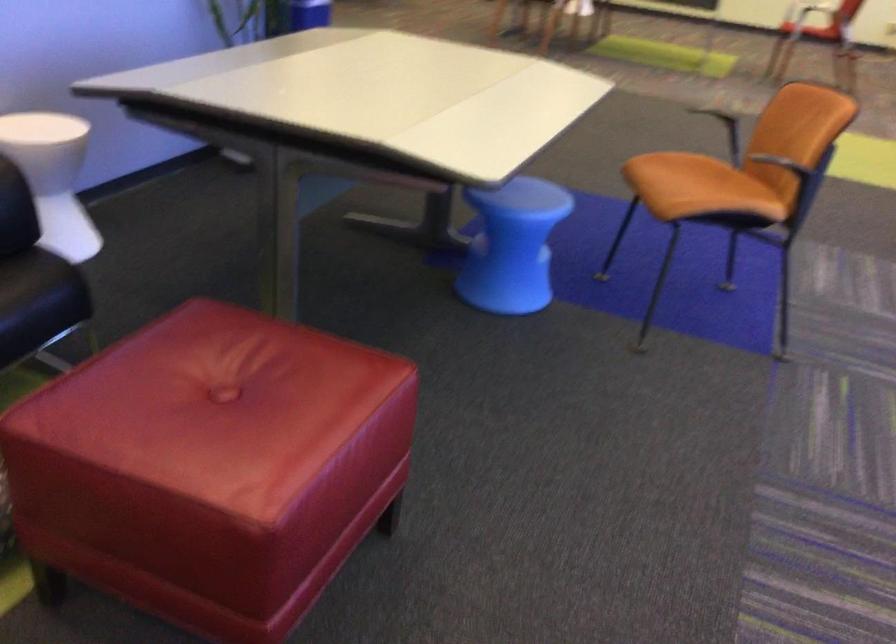
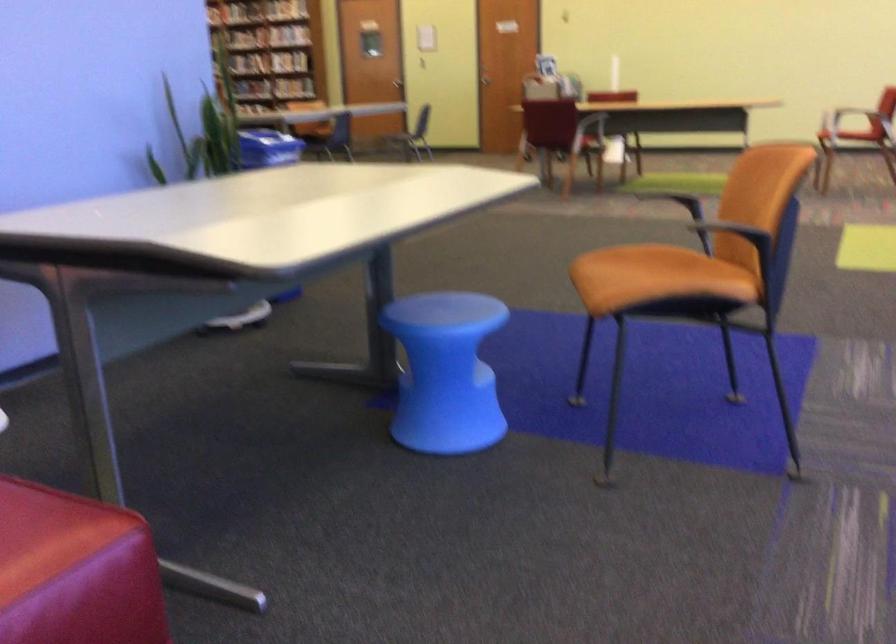
Question: I am providing you with two images of the same scene from different viewpoints. After the viewpoint changes to image2, which objects are now occluded?

Choices:
 (A) red sofa sitting surface
 (B) blue plastic bin
 (C) black chair armrest
 (D) none of these

Answer: (D)